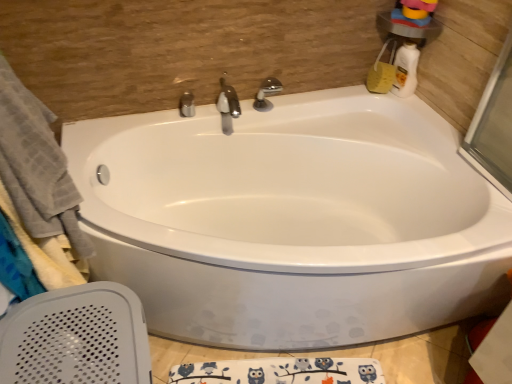
Question: Can you confirm if satin nickel faucet at center, the second tap in the left-to-right sequence, is wider than white glossy bottle at upper right?

Choices:
 (A) no
 (B) yes

Answer: (B)

Question: Can you confirm if satin nickel faucet at center, positioned as the second tap in right-to-left order, is bigger than white glossy bottle at upper right?

Choices:
 (A) yes
 (B) no

Answer: (A)

Question: From the image's perspective, is satin nickel faucet at center, the second tap in the left-to-right sequence, beneath white glossy bottle at upper right?

Choices:
 (A) no
 (B) yes

Answer: (B)

Question: Could white glossy bottle at upper right be considered to be inside satin nickel faucet at center, the second tap in the left-to-right sequence?

Choices:
 (A) no
 (B) yes

Answer: (A)

Question: Is satin nickel faucet at center, the second tap in the left-to-right sequence, to the right of white glossy bottle at upper right from the viewer's perspective?

Choices:
 (A) yes
 (B) no

Answer: (B)

Question: Considering the relative positions of polished chrome faucet at center, acting as the third tap starting from the right, and polished chrome faucet at upper center, acting as the 1th tap starting from the right, in the image provided, is polished chrome faucet at center, acting as the third tap starting from the right, to the left or to the right of polished chrome faucet at upper center, acting as the 1th tap starting from the right,?

Choices:
 (A) right
 (B) left

Answer: (B)

Question: Is point (185, 109) closer or farther from the camera than point (267, 82)?

Choices:
 (A) closer
 (B) farther

Answer: (A)

Question: Relative to polished chrome faucet at upper center, which is the 3th tap from left to right, is polished chrome faucet at center, the 1th tap positioned from the left, in front or behind?

Choices:
 (A) front
 (B) behind

Answer: (B)

Question: Is polished chrome faucet at center, the 1th tap positioned from the left, wider or thinner than polished chrome faucet at upper center, acting as the 1th tap starting from the right?

Choices:
 (A) thin
 (B) wide

Answer: (A)

Question: From a real-world perspective, is white glossy bathtub at center physically located above or below polished chrome faucet at upper center, acting as the 1th tap starting from the right?

Choices:
 (A) above
 (B) below

Answer: (B)

Question: Is white glossy bathtub at center taller or shorter than polished chrome faucet at upper center, which is the 3th tap from left to right?

Choices:
 (A) tall
 (B) short

Answer: (A)

Question: Would you say white glossy bathtub at center is to the left or to the right of polished chrome faucet at upper center, acting as the 1th tap starting from the right, in the picture?

Choices:
 (A) left
 (B) right

Answer: (B)

Question: Considering the positions of white glossy bathtub at center and polished chrome faucet at upper center, which is the 3th tap from left to right, in the image, is white glossy bathtub at center bigger or smaller than polished chrome faucet at upper center, which is the 3th tap from left to right,?

Choices:
 (A) small
 (B) big

Answer: (B)

Question: Based on their sizes in the image, would you say white glossy bottle at upper right is bigger or smaller than polished chrome faucet at center, acting as the third tap starting from the right?

Choices:
 (A) big
 (B) small

Answer: (A)

Question: Considering the positions of white glossy bottle at upper right and polished chrome faucet at center, the 1th tap positioned from the left, in the image, is white glossy bottle at upper right taller or shorter than polished chrome faucet at center, the 1th tap positioned from the left,?

Choices:
 (A) short
 (B) tall

Answer: (B)